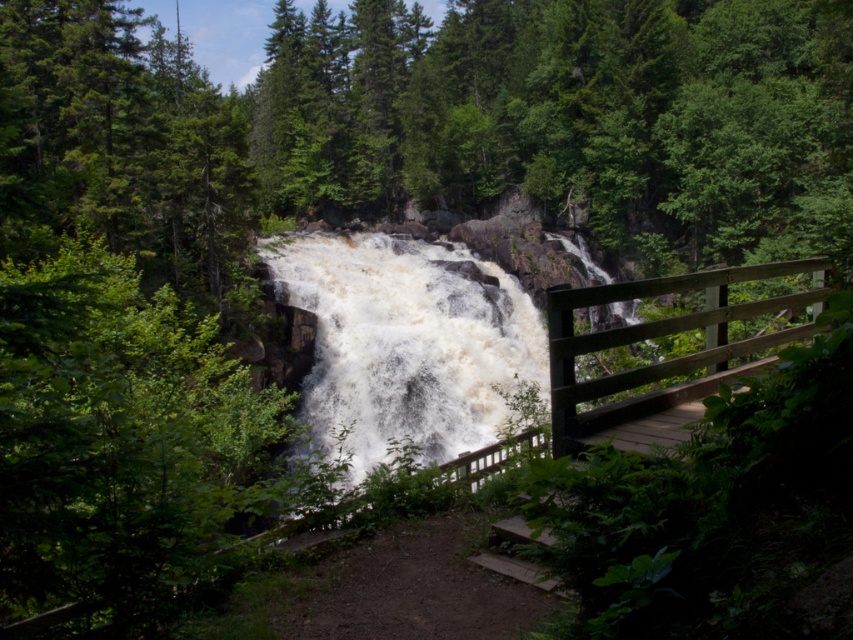
Question: Is white frothy water at center positioned at the back of brown wooden rail at center right?

Choices:
 (A) no
 (B) yes

Answer: (B)

Question: Is white frothy water at center closer to camera compared to brown wooden rail at center right?

Choices:
 (A) yes
 (B) no

Answer: (B)

Question: Which object appears closest to the camera in this image?

Choices:
 (A) white frothy water at center
 (B) brown wooden rail at center right

Answer: (B)

Question: Which point is closer to the camera?

Choices:
 (A) (425, 358)
 (B) (579, 445)

Answer: (B)

Question: Can you confirm if white frothy water at center is positioned above brown wooden rail at center right?

Choices:
 (A) yes
 (B) no

Answer: (A)